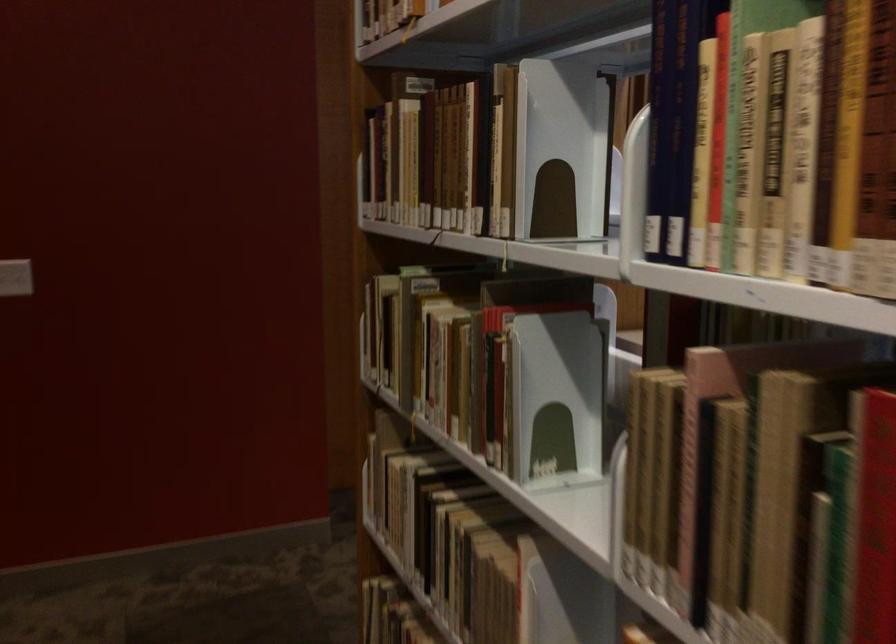
Find where to push the light switch. Please return your answer as a coordinate pair (x, y).

(15, 277)